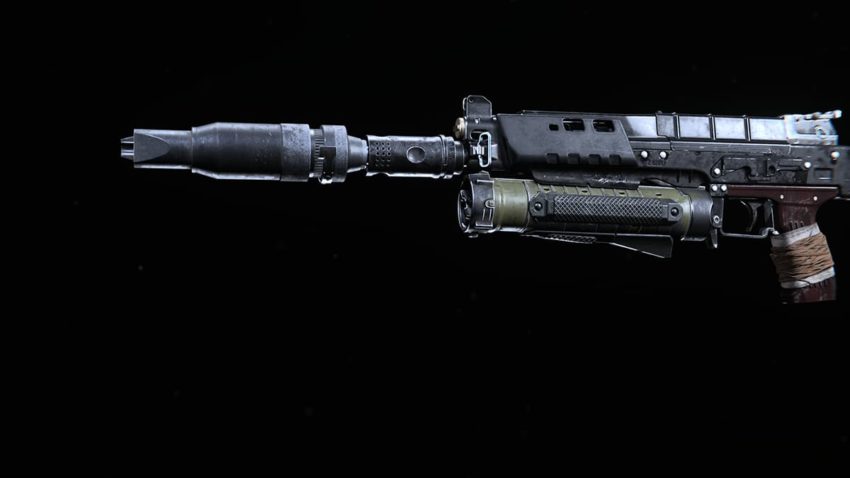
The image size is (850, 478). Identify the location of handle. (797, 259).